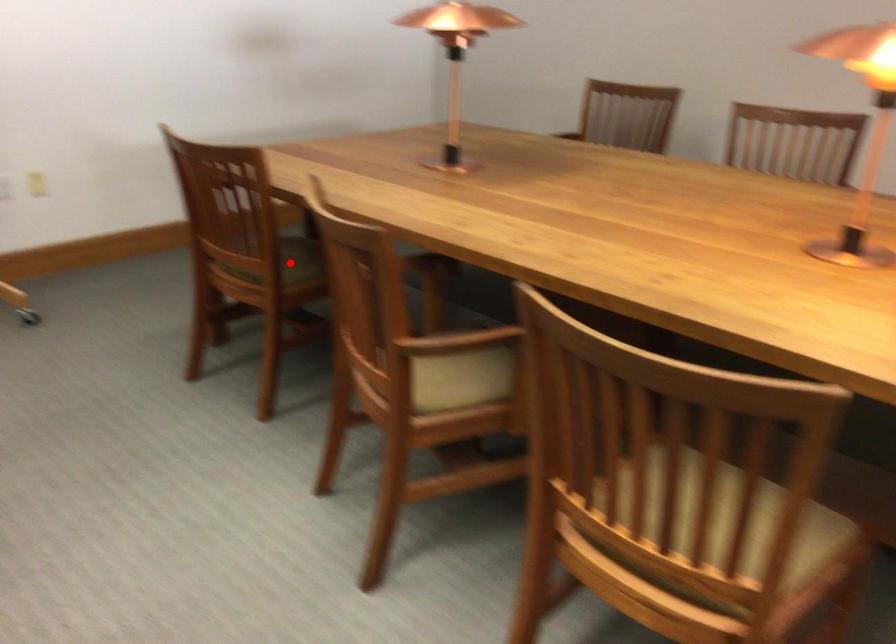
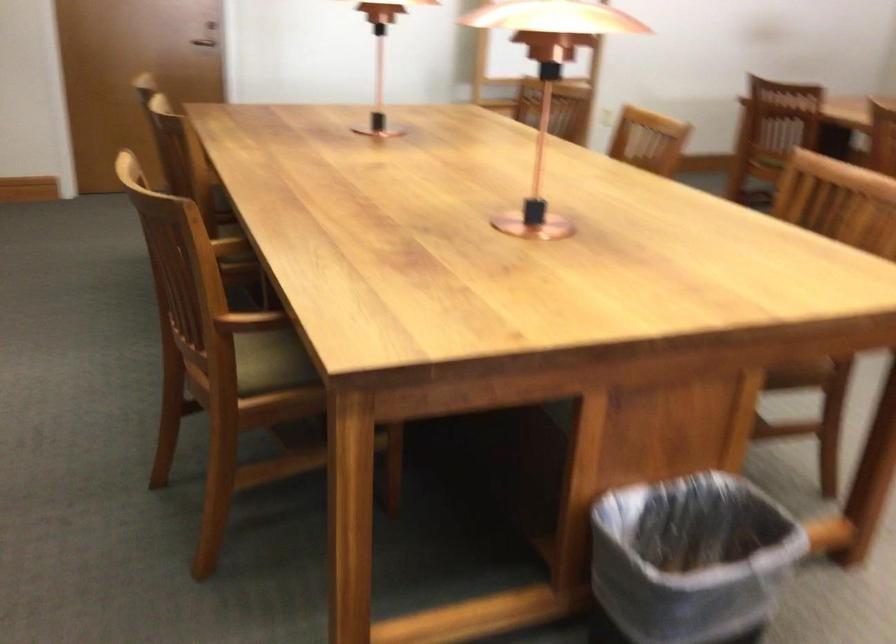
Question: I am providing you with two images of the same scene from different viewpoints. A red point is marked on the first image. At the location where the point appears in image 1, is it still visible in image 2?

Choices:
 (A) Yes
 (B) No

Answer: (B)